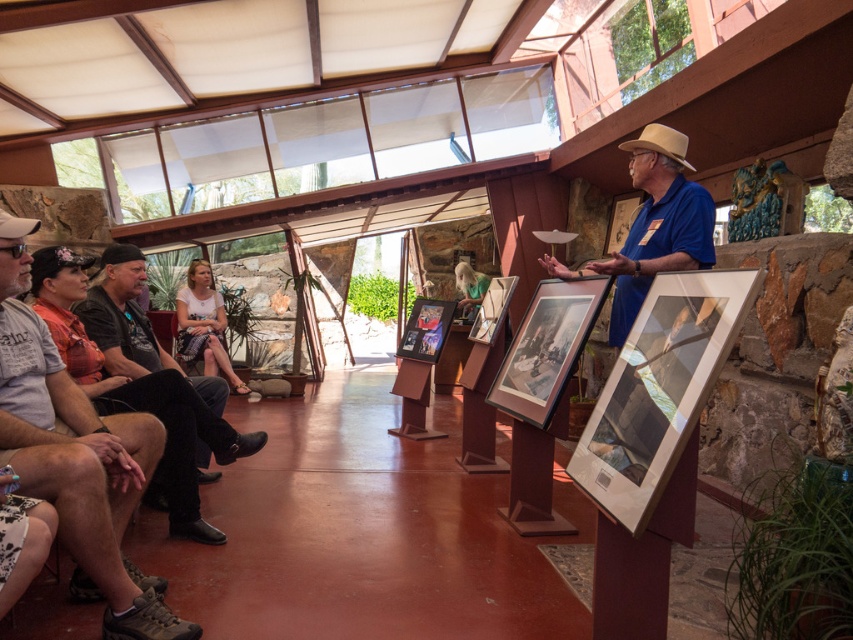
Does dark gray shirt at left have a lesser height compared to matte brown cowboy hat at upper left?

No, dark gray shirt at left is not shorter than matte brown cowboy hat at upper left.

Is point (117, 321) positioned after point (4, 216)?

Yes, it is.

At what (x,y) coordinates should I click in order to perform the action: click on dark gray shirt at left. Please return your answer as a coordinate pair (x, y). This screenshot has height=640, width=853. Looking at the image, I should click on (134, 326).

Can you confirm if tan straw cowboy hat at upper center is positioned above blonde hair at center?

Yes, tan straw cowboy hat at upper center is above blonde hair at center.

Which is in front, point (654, 140) or point (471, 298)?

Point (654, 140) is in front.

This screenshot has height=640, width=853. What are the coordinates of `tan straw cowboy hat at upper center` in the screenshot? It's located at (660, 141).

Does gray cotton shirt at left have a larger size compared to blonde hair at center?

Yes, gray cotton shirt at left is bigger than blonde hair at center.

In the scene shown: Which is more to the right, gray cotton shirt at left or blonde hair at center?

Positioned to the right is blonde hair at center.

What do you see at coordinates (78, 461) in the screenshot? I see `gray cotton shirt at left` at bounding box center [78, 461].

Where is `gray cotton shirt at left`? gray cotton shirt at left is located at coordinates (78, 461).